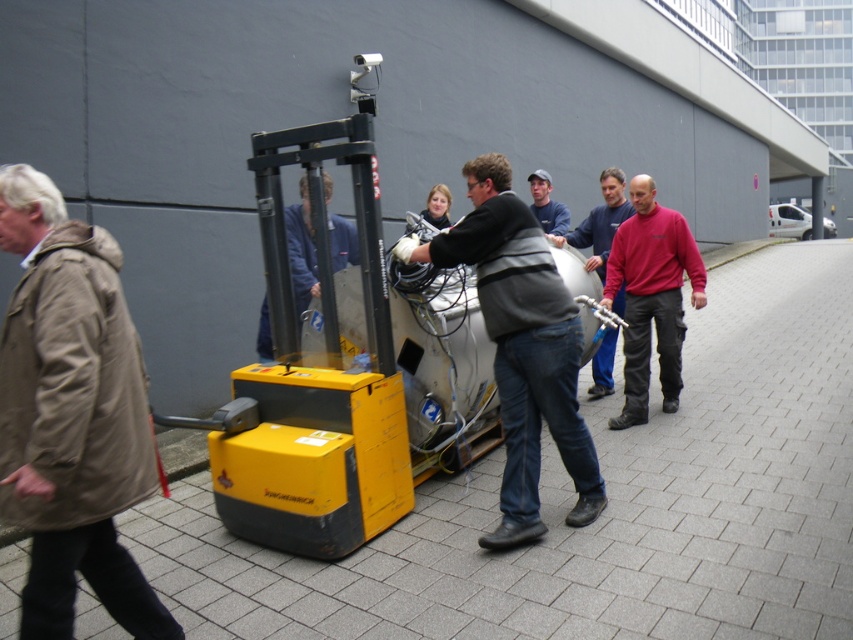
Question: Which point is farther to the camera?

Choices:
 (A) (592, 257)
 (B) (520, 305)

Answer: (A)

Question: Which object is farther from the camera taking this photo?

Choices:
 (A) khaki fabric coat at left
 (B) blue denim jeans at center

Answer: (B)

Question: Observing the image, what is the correct spatial positioning of khaki fabric coat at left in reference to dark gray jacket at center?

Choices:
 (A) left
 (B) right

Answer: (A)

Question: Is khaki fabric coat at left positioned in front of red fleece jacket at center?

Choices:
 (A) no
 (B) yes

Answer: (B)

Question: Which point is farther from the camera taking this photo?

Choices:
 (A) (38, 273)
 (B) (608, 378)

Answer: (B)

Question: Does dark gray jacket at center have a larger size compared to blue fabric jacket at center?

Choices:
 (A) yes
 (B) no

Answer: (A)